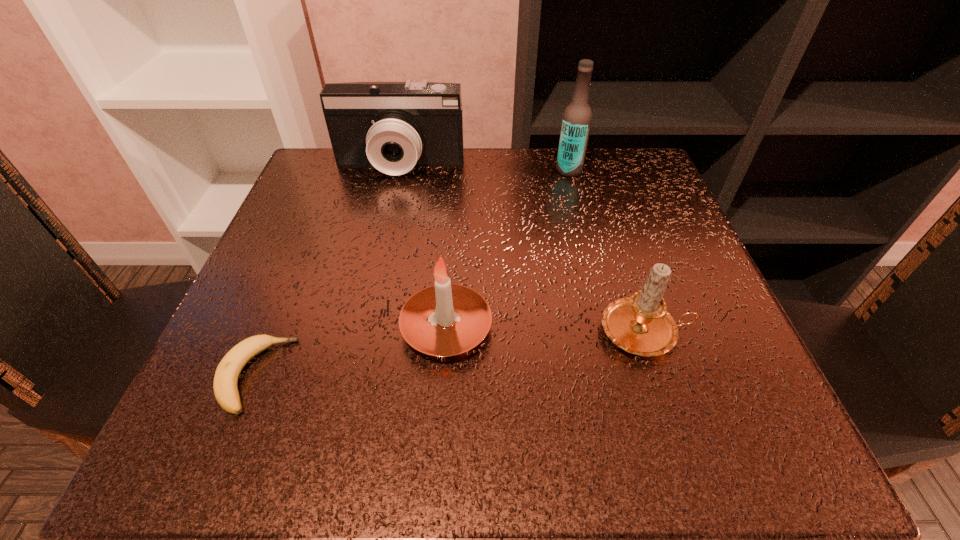
Where is `object that can be found as the closest to the shortest object`? The image size is (960, 540). object that can be found as the closest to the shortest object is located at coordinates (443, 320).

Locate an element on the screen. Image resolution: width=960 pixels, height=540 pixels. free space that satisfies the following two spatial constraints: 1. on the lens of the camcorder; 2. on the right side of the left candle is located at coordinates (363, 328).

Locate an element on the screen. The height and width of the screenshot is (540, 960). free space that satisfies the following two spatial constraints: 1. on the back side of the shortest object; 2. on the right side of the left candle is located at coordinates (275, 328).

At what (x,y) coordinates should I click in order to perform the action: click on free location that satisfies the following two spatial constraints: 1. on the back side of the right candle; 2. on the side of the beer bottle with the label. Please return your answer as a coordinate pair (x, y). The image size is (960, 540). Looking at the image, I should click on (593, 170).

Identify the location of free space in the image that satisfies the following two spatial constraints: 1. on the lens of the fourth shortest object; 2. on the left side of the right candle. Image resolution: width=960 pixels, height=540 pixels. (362, 333).

Locate an element on the screen. The width and height of the screenshot is (960, 540). vacant space that satisfies the following two spatial constraints: 1. on the back side of the right candle; 2. on the side of the tallest object with the label is located at coordinates (593, 170).

Identify the location of vacant space that satisfies the following two spatial constraints: 1. on the lens of the left candle; 2. on the right side of the fourth shortest object. This screenshot has width=960, height=540. click(363, 328).